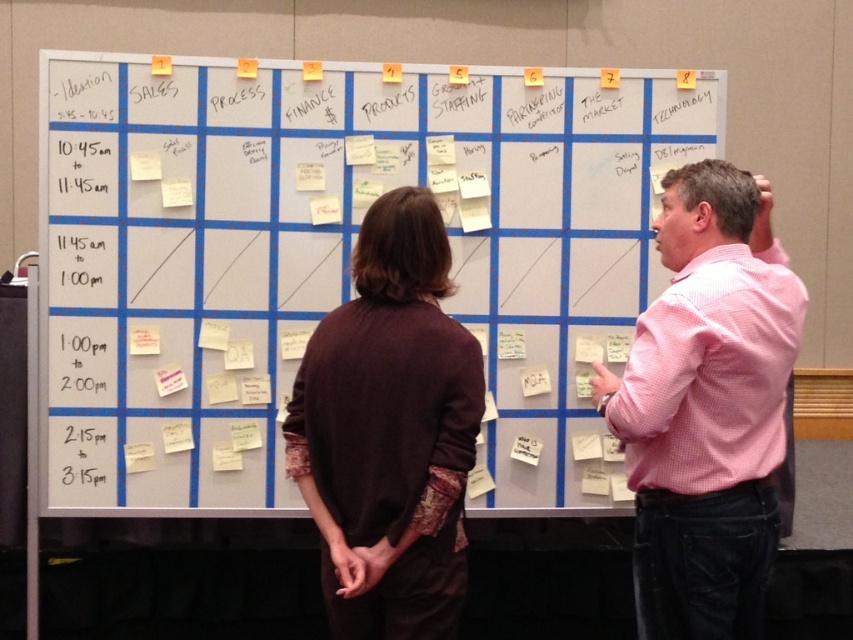
Between white paperboard at center and pink checkered shirt at upper right, which one is positioned higher?

Positioned higher is white paperboard at center.

Between point (619, 83) and point (778, 326), which one is positioned in front?

Point (778, 326) is more forward.

What do you see at coordinates (328, 256) in the screenshot? I see `white paperboard at center` at bounding box center [328, 256].

Find the location of a particular element. This screenshot has width=853, height=640. white paperboard at center is located at coordinates (328, 256).

Between point (718, 342) and point (695, 564), which one is positioned in front?

Positioned in front is point (718, 342).

The height and width of the screenshot is (640, 853). Identify the location of pink checkered shirt at upper right. (706, 406).

Where is `pink checkered shirt at upper right`? pink checkered shirt at upper right is located at coordinates (706, 406).

Is pink checkered shirt at upper right smaller than brown wool sweater at center?

No, pink checkered shirt at upper right is not smaller than brown wool sweater at center.

Where is `pink checkered shirt at upper right`? The image size is (853, 640). pink checkered shirt at upper right is located at coordinates (706, 406).